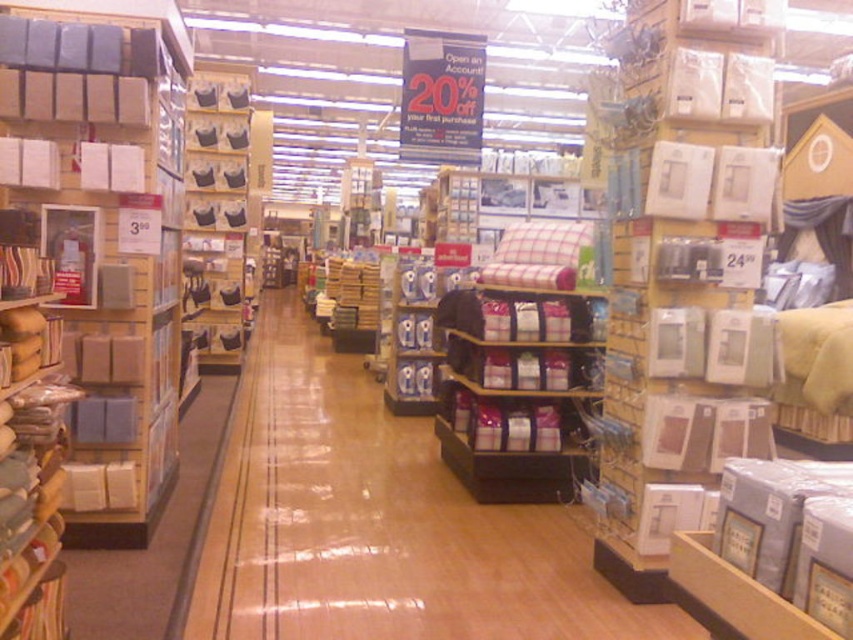
You are standing in the middle of the home goods store aisle. There are two points marked in the scene, one at coordinate point (248, 467) and another at point (253, 218). If you want to walk towards the point that is closer to you, which coordinate should you head towards?

Point (248, 467) is in front of point (253, 218), so you should head towards point (248, 467) since it is closer to you.